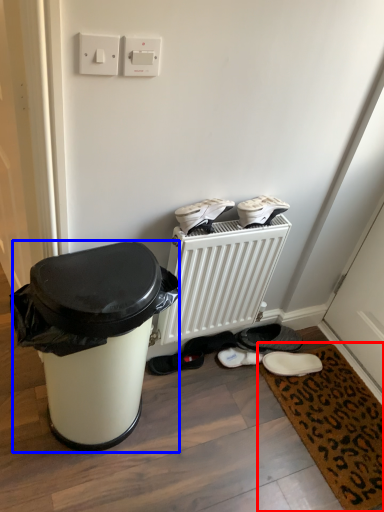
Question: Which point is further to the camera, doormat (highlighted by a red box) or waste container (highlighted by a blue box)?

Choices:
 (A) doormat
 (B) waste container

Answer: (A)